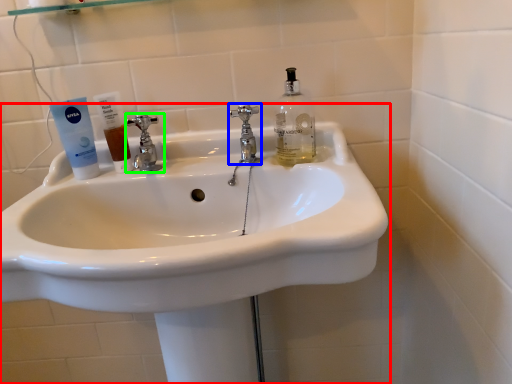
Question: Considering the real-world distances, which object is farthest from sink (highlighted by a red box)? tap (highlighted by a blue box) or tap (highlighted by a green box)?

Choices:
 (A) tap
 (B) tap

Answer: (B)